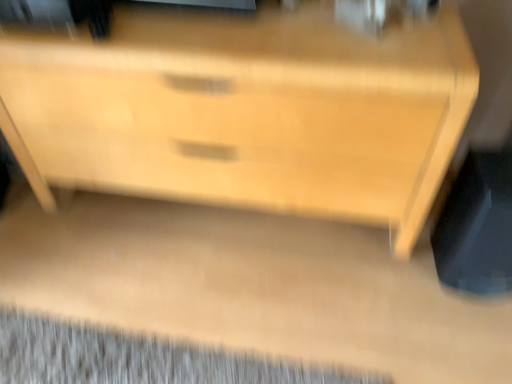
The image size is (512, 384). What do you see at coordinates (138, 358) in the screenshot?
I see `gray textured mat at lower left` at bounding box center [138, 358].

The image size is (512, 384). I want to click on light wood chest of drawers at center, so click(x=246, y=109).

Describe the element at coordinates (477, 226) in the screenshot. The width and height of the screenshot is (512, 384). I see `black plastic swivel chair at lower right` at that location.

The height and width of the screenshot is (384, 512). I want to click on gray textured mat at lower left, so click(138, 358).

Would you say light wood chest of drawers at center is inside or outside gray textured mat at lower left?

light wood chest of drawers at center exists outside the volume of gray textured mat at lower left.

What's the angular difference between light wood chest of drawers at center and gray textured mat at lower left's facing directions?

There is a 90.5-degree angle between the facing directions of light wood chest of drawers at center and gray textured mat at lower left.

Who is shorter, light wood chest of drawers at center or gray textured mat at lower left?

Standing shorter between the two is gray textured mat at lower left.

Does light wood chest of drawers at center have a greater width compared to gray textured mat at lower left?

In fact, light wood chest of drawers at center might be narrower than gray textured mat at lower left.

Considering the positions of objects gray textured mat at lower left and black plastic swivel chair at lower right in the image provided, who is more to the left, gray textured mat at lower left or black plastic swivel chair at lower right?

gray textured mat at lower left is more to the left.

Is gray textured mat at lower left in front of or behind black plastic swivel chair at lower right in the image?

Visually, gray textured mat at lower left is located behind black plastic swivel chair at lower right.

Is gray textured mat at lower left situated inside black plastic swivel chair at lower right or outside?

gray textured mat at lower left is not enclosed by black plastic swivel chair at lower right.

From a real-world perspective, which object stands above the other?

black plastic swivel chair at lower right.

Which is nearer, (494, 182) or (302, 364)?

Point (494, 182) is farther from the camera than point (302, 364).

Looking at this image, which of these two, black plastic swivel chair at lower right or gray textured mat at lower left, stands shorter?

With less height is gray textured mat at lower left.

From a real-world perspective, is black plastic swivel chair at lower right on top of gray textured mat at lower left?

Yes, from a real-world perspective, black plastic swivel chair at lower right is on top of gray textured mat at lower left.

Could you tell me if black plastic swivel chair at lower right is turned towards gray textured mat at lower left?

No, black plastic swivel chair at lower right does not turn towards gray textured mat at lower left.

Can you confirm if light wood chest of drawers at center is taller than black plastic swivel chair at lower right?

Yes, light wood chest of drawers at center is taller than black plastic swivel chair at lower right.

Does light wood chest of drawers at center appear on the right side of black plastic swivel chair at lower right?

No.

From a real-world perspective, is light wood chest of drawers at center below black plastic swivel chair at lower right?

No, from a real-world perspective, light wood chest of drawers at center is not under black plastic swivel chair at lower right.

From a real-world perspective, is black plastic swivel chair at lower right physically below light wood chest of drawers at center?

Correct, in the physical world, black plastic swivel chair at lower right is lower than light wood chest of drawers at center.

Between black plastic swivel chair at lower right and light wood chest of drawers at center, which one has larger size?

With larger size is light wood chest of drawers at center.

Does black plastic swivel chair at lower right have a lesser height compared to light wood chest of drawers at center?

Correct, black plastic swivel chair at lower right is not as tall as light wood chest of drawers at center.

Considering the relative positions of black plastic swivel chair at lower right and light wood chest of drawers at center in the image provided, is black plastic swivel chair at lower right to the left or to the right of light wood chest of drawers at center?

black plastic swivel chair at lower right is positioned on light wood chest of drawers at center's right side.

Who is bigger, gray textured mat at lower left or light wood chest of drawers at center?

light wood chest of drawers at center is bigger.

Identify the location of chest of drawers above the gray textured mat at lower left (from a real-world perspective). (246, 109).

Is gray textured mat at lower left in contact with light wood chest of drawers at center?

gray textured mat at lower left is not next to light wood chest of drawers at center, and they're not touching.

Where is `the chest of drawers in front of the gray textured mat at lower left`? The image size is (512, 384). the chest of drawers in front of the gray textured mat at lower left is located at coordinates (246, 109).

Identify the location of mat behind the black plastic swivel chair at lower right. The image size is (512, 384). (138, 358).

Estimate the real-world distances between objects in this image. Which object is further from gray textured mat at lower left, light wood chest of drawers at center or black plastic swivel chair at lower right?

black plastic swivel chair at lower right is further to gray textured mat at lower left.

Consider the image. From the image, which object appears to be farther from black plastic swivel chair at lower right, light wood chest of drawers at center or gray textured mat at lower left?

gray textured mat at lower left lies further to black plastic swivel chair at lower right than the other object.

From the image, which object appears to be farther from light wood chest of drawers at center, gray textured mat at lower left or black plastic swivel chair at lower right?

Based on the image, gray textured mat at lower left appears to be further to light wood chest of drawers at center.

Consider the image. When comparing their distances from light wood chest of drawers at center, does black plastic swivel chair at lower right or gray textured mat at lower left seem further?

The object further to light wood chest of drawers at center is gray textured mat at lower left.

Based on their spatial positions, is black plastic swivel chair at lower right or light wood chest of drawers at center closer to gray textured mat at lower left?

Among the two, light wood chest of drawers at center is located nearer to gray textured mat at lower left.

When comparing their distances from black plastic swivel chair at lower right, does gray textured mat at lower left or light wood chest of drawers at center seem closer?

The object closer to black plastic swivel chair at lower right is light wood chest of drawers at center.

What are the coordinates of `chest of drawers between gray textured mat at lower left and black plastic swivel chair at lower right in the horizontal direction` in the screenshot? It's located at (246, 109).